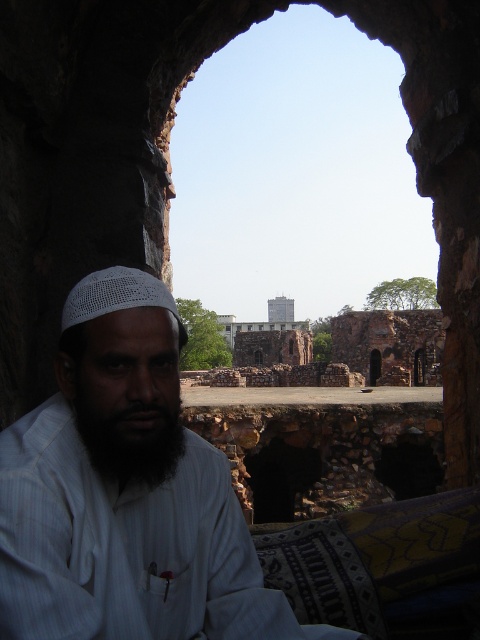
You are standing in front of the stone archway and want to take a photo of both the man in the foreground and the ancient stone structures in the background. Which point, point (0,593) or point (164,417), is closer to your camera when focusing on the man?

Point (0,593) is closer to the camera than point (164,417). Since the man is in the foreground, focusing on the closer point will ensure the man is in focus while the background structures may appear slightly blurred.